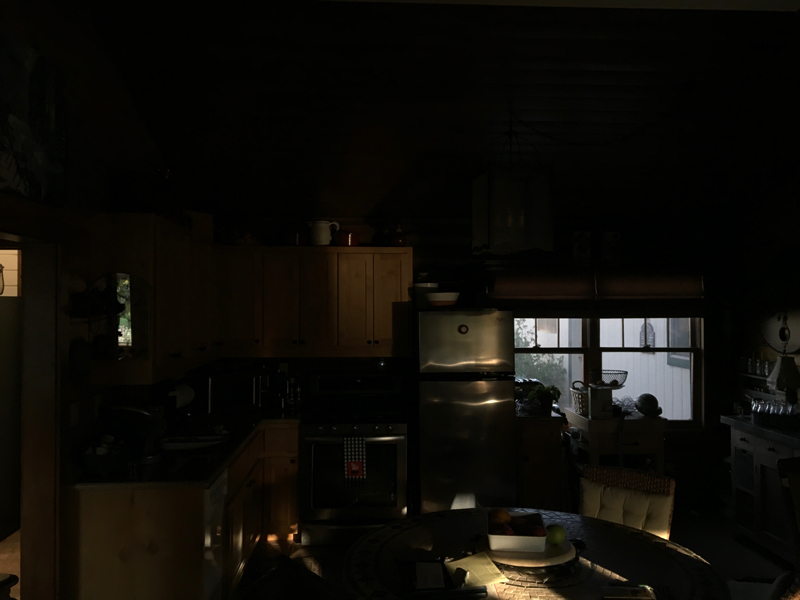
Where is `bowl`? bowl is located at coordinates (609, 376).